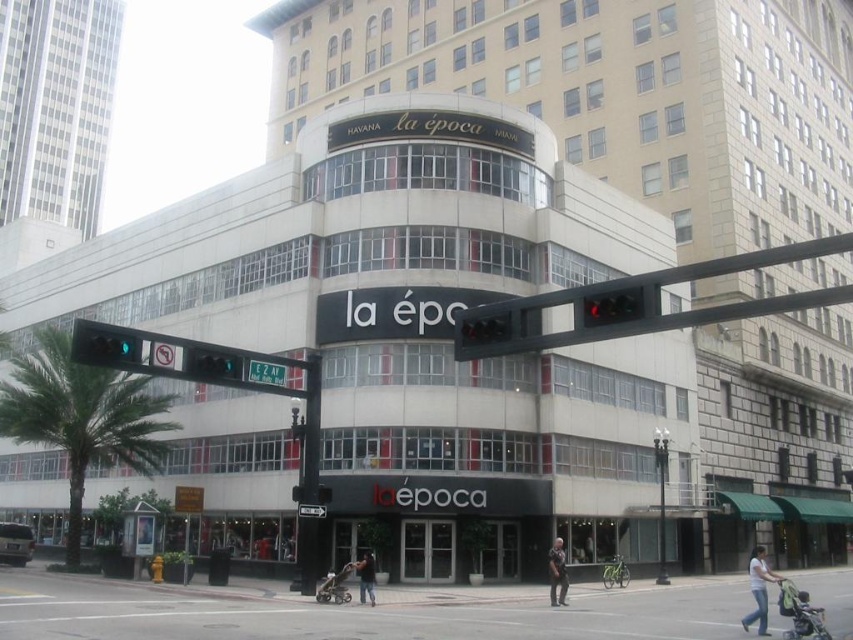
Is black glass traffic light at upper center shorter than green metallic street sign at upper center?

Correct, black glass traffic light at upper center is not as tall as green metallic street sign at upper center.

Does point (490, 326) lie in front of point (271, 372)?

That is True.

You are a GUI agent. You are given a task and a screenshot of the screen. Output one action in this format:
    pyautogui.click(x=<x>, y=<y>)
    Task: Click on the black glass traffic light at upper center
    The image size is (853, 640).
    Given the screenshot: What is the action you would take?
    pyautogui.click(x=485, y=330)

Can you confirm if white cotton shirt at lower right is positioned below dark blue jeans at center?

Yes.

Is point (751, 577) positioned behind point (367, 566)?

That is False.

You are a GUI agent. You are given a task and a screenshot of the screen. Output one action in this format:
    pyautogui.click(x=<x>, y=<y>)
    Task: Click on the white cotton shirt at lower right
    Image resolution: width=853 pixels, height=640 pixels.
    Given the screenshot: What is the action you would take?
    pyautogui.click(x=759, y=589)

Is point (791, 628) farther from camera compared to point (560, 548)?

That is False.

What are the coordinates of `dark gray fabric stroller at lower right` in the screenshot? It's located at (799, 612).

Where is `dark gray fabric stroller at lower right`? This screenshot has width=853, height=640. dark gray fabric stroller at lower right is located at coordinates (799, 612).